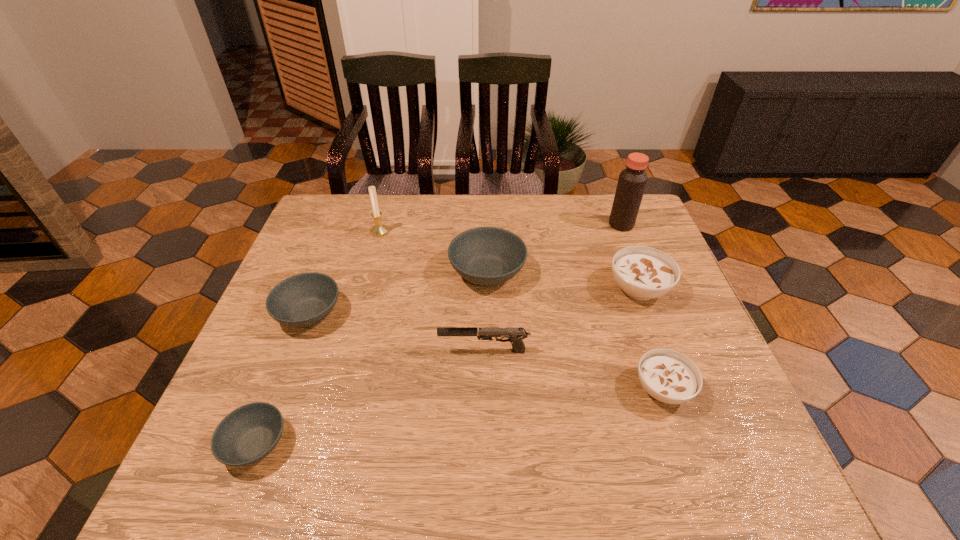
Identify the location of vacant space located on the back of the second smallest gray soup bowl. Image resolution: width=960 pixels, height=540 pixels. (342, 228).

Where is `free location located on the left of the nearer white soup bowl`? free location located on the left of the nearer white soup bowl is located at coordinates (535, 389).

Identify the location of blank space located on the back of the shortest soup bowl. The width and height of the screenshot is (960, 540). (309, 307).

Where is `vinegar located in the far edge section of the desktop`? vinegar located in the far edge section of the desktop is located at coordinates (632, 181).

Where is `candle holder present at the far edge`? The image size is (960, 540). candle holder present at the far edge is located at coordinates [x=379, y=229].

At what (x,y) coordinates should I click in order to perform the action: click on object located at the near edge. Please return your answer as a coordinate pair (x, y). Looking at the image, I should click on click(x=248, y=434).

Where is `vinegar present at the right edge`? vinegar present at the right edge is located at coordinates (632, 181).

This screenshot has width=960, height=540. Identify the location of object that is positioned at the near left corner. click(248, 434).

Find the location of a particular element. object located in the far right corner section of the desktop is located at coordinates (632, 181).

The image size is (960, 540). I want to click on free space at the far edge, so click(511, 215).